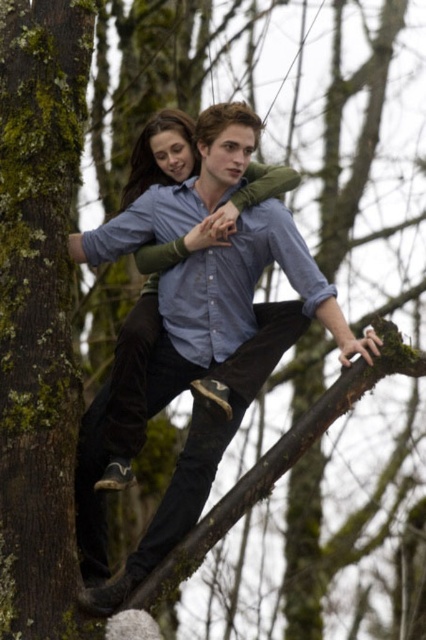
Is brown rough bark at left taller than matte blue shirt at center?

Correct, brown rough bark at left is much taller as matte blue shirt at center.

This screenshot has height=640, width=426. What do you see at coordinates (39, 308) in the screenshot? I see `brown rough bark at left` at bounding box center [39, 308].

Does point (17, 144) come farther from viewer compared to point (111, 410)?

No.

The image size is (426, 640). In order to click on brown rough bark at left in this screenshot , I will do `click(39, 308)`.